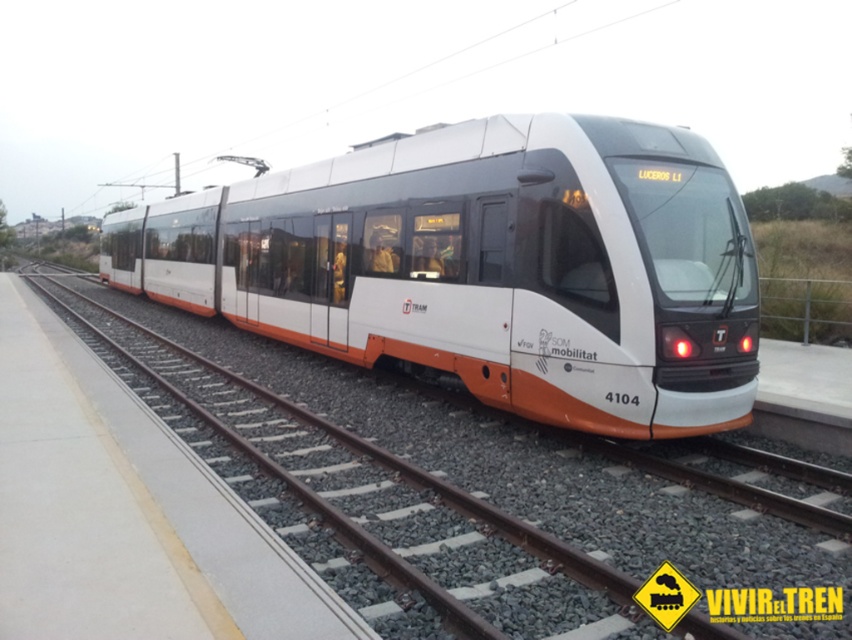
Is white matte train at center thinner than white metal track at center?

Incorrect, white matte train at center's width is not less than white metal track at center's.

Which of these two, white matte train at center or white metal track at center, stands shorter?

white metal track at center is shorter.

The image size is (852, 640). Find the location of `white matte train at center`. white matte train at center is located at coordinates (487, 266).

Locate an element on the screen. This screenshot has height=640, width=852. white matte train at center is located at coordinates (487, 266).